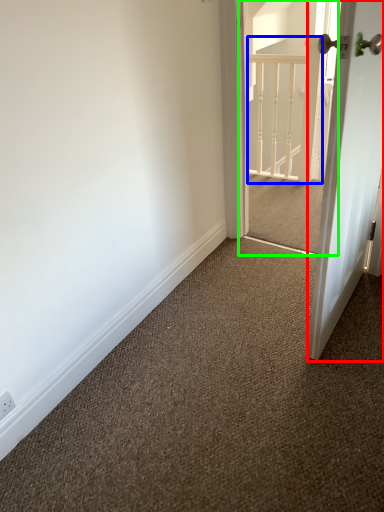
Question: Which object is the farthest from door (highlighted by a red box)? Choose among these: rail (highlighted by a blue box) or screen door (highlighted by a green box).

Choices:
 (A) rail
 (B) screen door

Answer: (A)